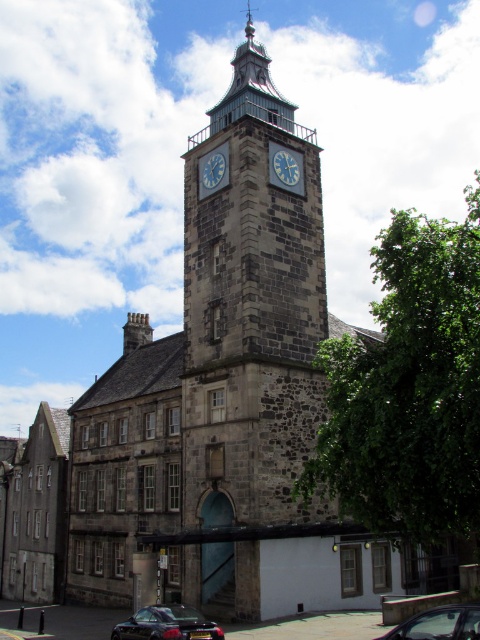
Who is more forward, (180, 637) or (288, 154)?

Point (180, 637) is in front.

Can you confirm if shiny black car at lower left is smaller than blue metallic clock at center?

Actually, shiny black car at lower left might be larger than blue metallic clock at center.

Does point (175, 637) come closer to viewer compared to point (285, 164)?

Yes, it is.

Identify the location of shiny black car at lower left. (167, 625).

Between metallic silver car at lower center and blue painted metal clock at center, which one is positioned higher?

Positioned higher is blue painted metal clock at center.

Is metallic silver car at lower center smaller than blue painted metal clock at center?

No.

Between point (434, 609) and point (204, 172), which one is positioned in front?

Positioned in front is point (434, 609).

The width and height of the screenshot is (480, 640). What are the coordinates of `metallic silver car at lower center` in the screenshot? It's located at (440, 624).

Which is below, stone clock tower at center or blue metallic clock at center?

blue metallic clock at center is lower down.

Who is more forward, (x=237, y=84) or (x=282, y=157)?

Positioned in front is point (x=282, y=157).

This screenshot has width=480, height=640. What do you see at coordinates (249, 339) in the screenshot?
I see `stone clock tower at center` at bounding box center [249, 339].

This screenshot has height=640, width=480. What are the coordinates of `stone clock tower at center` in the screenshot? It's located at (249, 339).